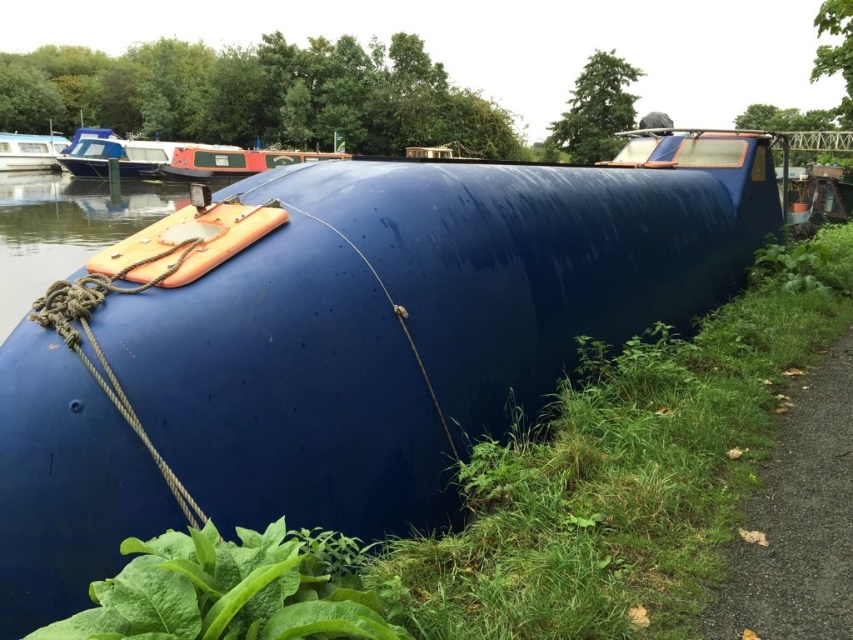
You are standing on the gravel path at lower right and want to reach the matte orange buoy at upper left. According to the scene, which direction should you move to get closer to the buoy?

The gravel path at lower right is located below the matte orange buoy at upper left, so you should move upward or northward to get closer to the buoy.

Looking at this image, you are standing on the paved path next to the blue tank. You notice two green elements in the scene. One is the green grass at lower right and the other is the green leafy plant at lower center. Which of these two is taller?

The green grass at lower right is taller than the green leafy plant at lower center according to the description.